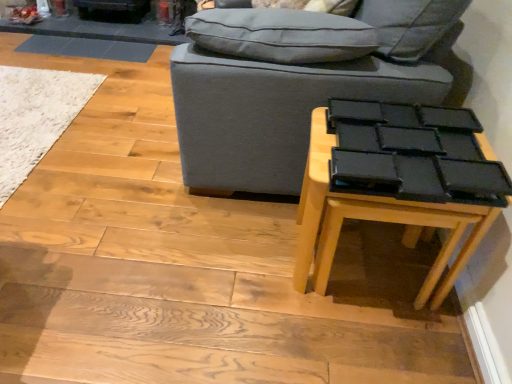
Question: From the image's perspective, is black matte table at lower right above white shaggy rug at lower left?

Choices:
 (A) no
 (B) yes

Answer: (A)

Question: Does black matte table at lower right come behind white shaggy rug at lower left?

Choices:
 (A) no
 (B) yes

Answer: (A)

Question: Can we say black matte table at lower right lies outside white shaggy rug at lower left?

Choices:
 (A) no
 (B) yes

Answer: (B)

Question: Would you say black matte table at lower right is a long distance from white shaggy rug at lower left?

Choices:
 (A) no
 (B) yes

Answer: (B)

Question: Does black matte table at lower right appear on the left side of white shaggy rug at lower left?

Choices:
 (A) no
 (B) yes

Answer: (A)

Question: Does point (301, 288) appear closer or farther from the camera than point (48, 127)?

Choices:
 (A) farther
 (B) closer

Answer: (B)

Question: Considering the relative positions of black matte table at lower right and white shaggy rug at lower left in the image provided, is black matte table at lower right to the left or to the right of white shaggy rug at lower left?

Choices:
 (A) right
 (B) left

Answer: (A)

Question: Considering their positions, is black matte table at lower right located in front of or behind white shaggy rug at lower left?

Choices:
 (A) behind
 (B) front

Answer: (B)

Question: In terms of height, does black matte table at lower right look taller or shorter compared to white shaggy rug at lower left?

Choices:
 (A) tall
 (B) short

Answer: (A)

Question: In terms of height, does white shaggy rug at lower left look taller or shorter compared to black matte table at lower right?

Choices:
 (A) short
 (B) tall

Answer: (A)

Question: Based on their sizes in the image, would you say white shaggy rug at lower left is bigger or smaller than black matte table at lower right?

Choices:
 (A) big
 (B) small

Answer: (B)

Question: From the image's perspective, is white shaggy rug at lower left located above or below black matte table at lower right?

Choices:
 (A) below
 (B) above

Answer: (B)

Question: From a real-world perspective, relative to black matte table at lower right, is white shaggy rug at lower left vertically above or below?

Choices:
 (A) below
 (B) above

Answer: (A)

Question: From a real-world perspective, is black matte table at lower right physically located above or below gray fabric studio couch at center?

Choices:
 (A) above
 (B) below

Answer: (B)

Question: Is black matte table at lower right in front of or behind gray fabric studio couch at center in the image?

Choices:
 (A) behind
 (B) front

Answer: (B)